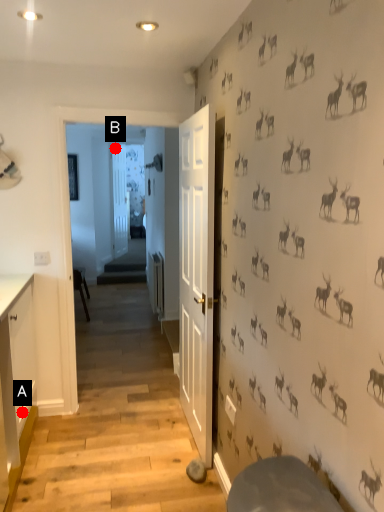
Question: Two points are circled on the image, labeled by A and B beside each circle. Which point is closer to the camera taking this photo?

Choices:
 (A) A is closer
 (B) B is closer

Answer: (A)